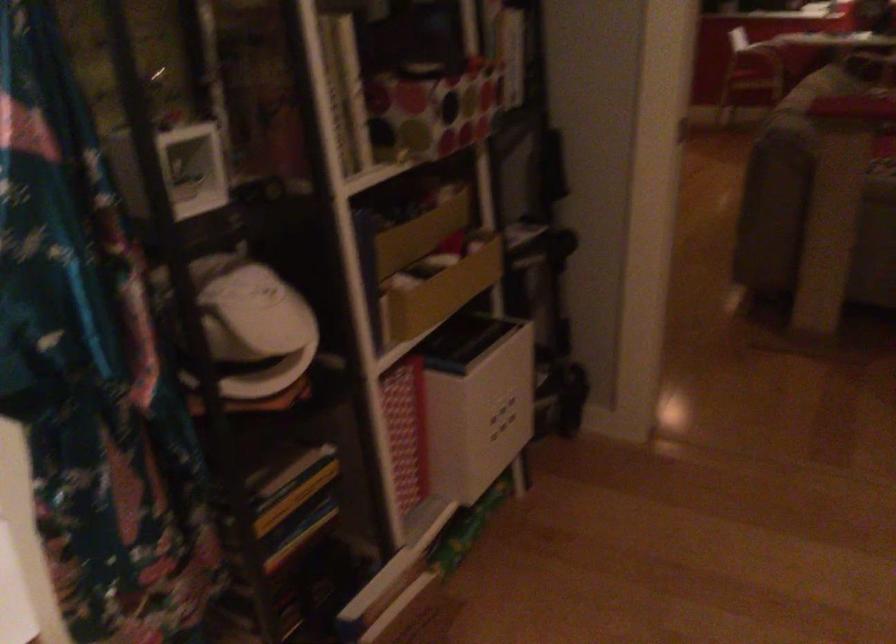
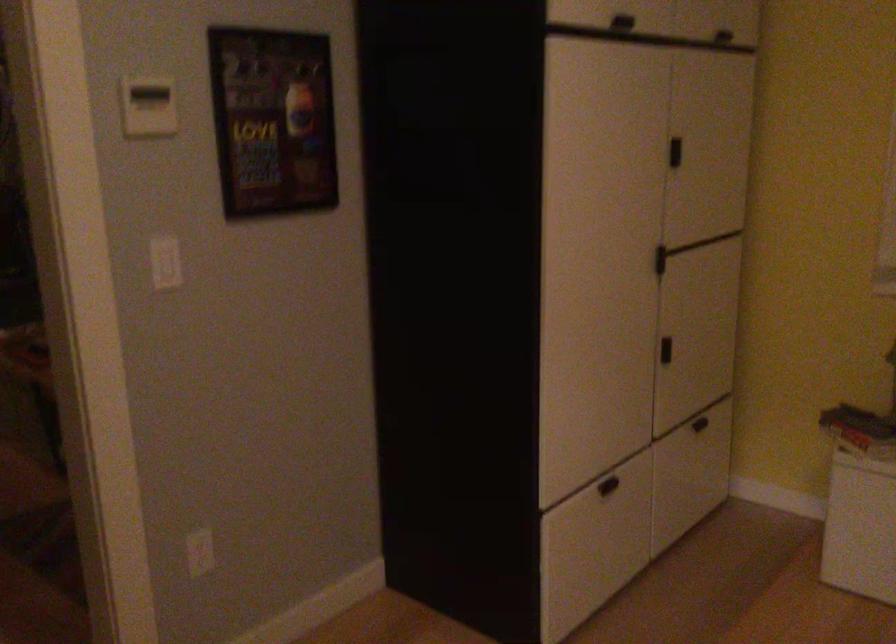
Question: The images are taken continuously from a first-person perspective. In which direction is your viewpoint rotating?

Choices:
 (A) Left
 (B) Right
 (C) Up
 (D) Down

Answer: (B)